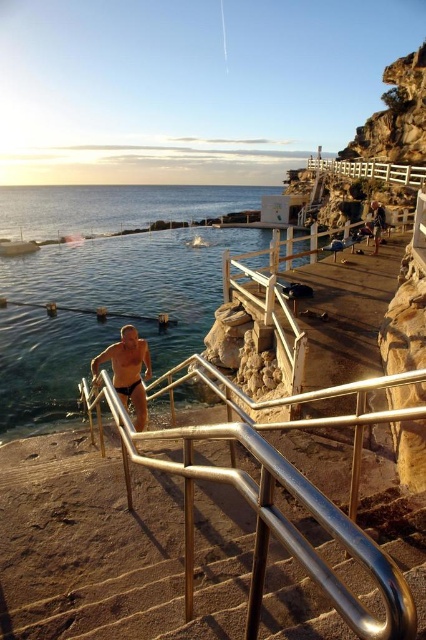
Question: Observing the image, what is the correct spatial positioning of matte black swim trunks at lower center in reference to white wooden railing at upper center?

Choices:
 (A) above
 (B) below

Answer: (B)

Question: Which of the following is the farthest from the observer?

Choices:
 (A) (141, 344)
 (B) (351, 621)
 (C) (345, 172)

Answer: (C)

Question: Which point is farther to the camera?

Choices:
 (A) matte black swim trunks at lower center
 (B) white wooden railing at upper center
 (C) silver metallic handrail at center

Answer: (B)

Question: Does matte black swim trunks at lower center have a larger size compared to white wooden railing at upper center?

Choices:
 (A) yes
 (B) no

Answer: (B)

Question: Which object is the farthest from the matte black swim trunks at lower center?

Choices:
 (A) silver metallic handrail at center
 (B) white wooden railing at upper center

Answer: (B)

Question: Is matte black swim trunks at lower center to the left of white wooden railing at upper center from the viewer's perspective?

Choices:
 (A) no
 (B) yes

Answer: (B)